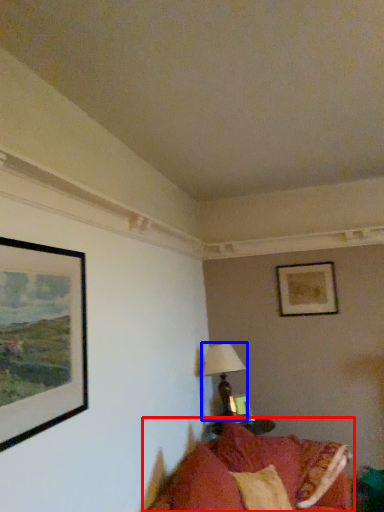
Question: Which object is further to the camera taking this photo, studio couch (highlighted by a red box) or table lamp (highlighted by a blue box)?

Choices:
 (A) studio couch
 (B) table lamp

Answer: (B)